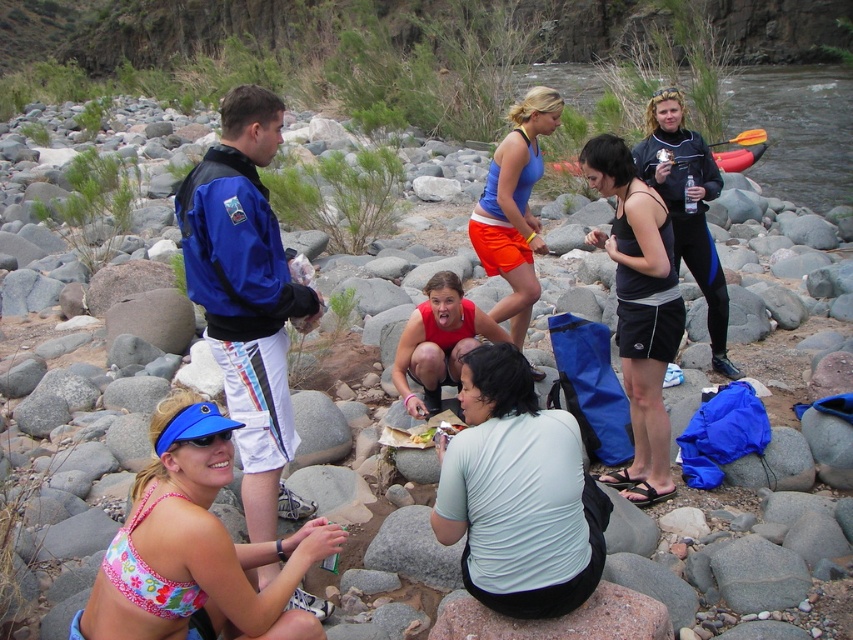
Question: Which of the following is the closest to the observer?

Choices:
 (A) (704, 257)
 (B) (189, 179)
 (C) (730, 141)

Answer: (B)

Question: Which point is closer to the camera?

Choices:
 (A) floral fabric bikini top at lower left
 (B) light gray cotton shirt at center
 (C) black wetsuit at center

Answer: (A)

Question: Is floral fabric bikini top at lower left to the right of blue matte tank top at center from the viewer's perspective?

Choices:
 (A) no
 (B) yes

Answer: (A)

Question: Which point appears farthest from the camera in this image?

Choices:
 (A) (670, 310)
 (B) (524, 518)
 (C) (163, 611)
 (D) (672, 182)

Answer: (D)

Question: Is light gray cotton shirt at center wider than orange rubber paddle at upper right?

Choices:
 (A) yes
 (B) no

Answer: (B)

Question: Does blue jacket at upper left come in front of blue matte tank top at center?

Choices:
 (A) no
 (B) yes

Answer: (B)